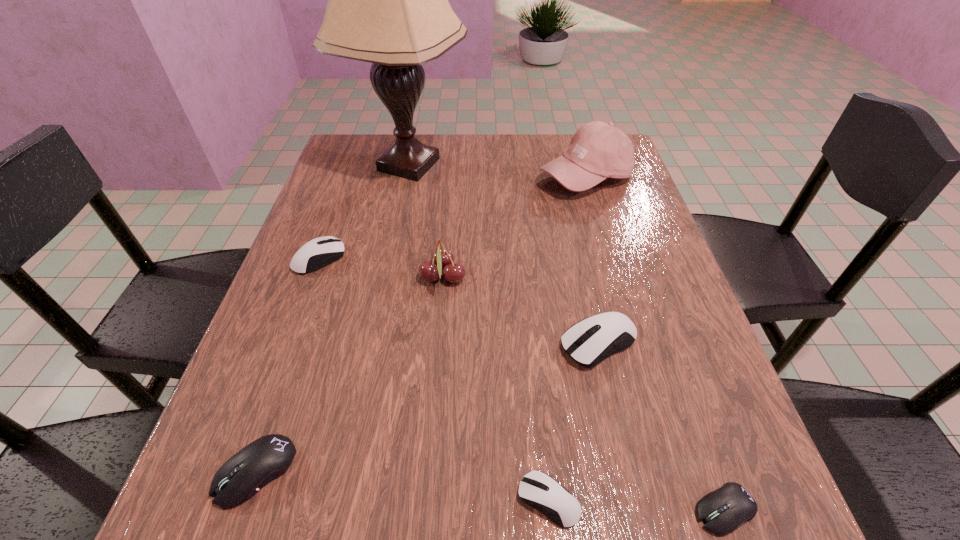
Find the location of a particular element. This screenshot has width=960, height=540. the tallest object is located at coordinates (388, 4).

This screenshot has height=540, width=960. What are the coordinates of `beige lamp` in the screenshot? It's located at (388, 4).

You are a GUI agent. You are given a task and a screenshot of the screen. Output one action in this format:
    pyautogui.click(x=<x>, y=<y>)
    Task: Click on the pink baseball cap
    This screenshot has height=540, width=960.
    Given the screenshot: What is the action you would take?
    pyautogui.click(x=598, y=150)

Image resolution: width=960 pixels, height=540 pixels. What are the coordinates of `the seventh shortest object` in the screenshot? It's located at (598, 150).

Locate an element on the screen. the third tallest object is located at coordinates (442, 257).

The height and width of the screenshot is (540, 960). In order to click on cherry in this screenshot , I will do `click(442, 257)`.

At what (x,y) coordinates should I click in order to perform the action: click on the tallest computer equipment. Please return your answer as a coordinate pair (x, y). Image resolution: width=960 pixels, height=540 pixels. Looking at the image, I should click on (588, 342).

Locate an element on the screen. This screenshot has width=960, height=540. the biggest white mouse is located at coordinates (588, 342).

Find the location of a particular element. The width and height of the screenshot is (960, 540). the second biggest white mouse is located at coordinates (319, 252).

You are a GUI agent. You are given a task and a screenshot of the screen. Output one action in this format:
    pyautogui.click(x=<x>, y=<y>)
    Task: Click on the leftmost white mouse
    The image size is (960, 540).
    Given the screenshot: What is the action you would take?
    pyautogui.click(x=319, y=252)